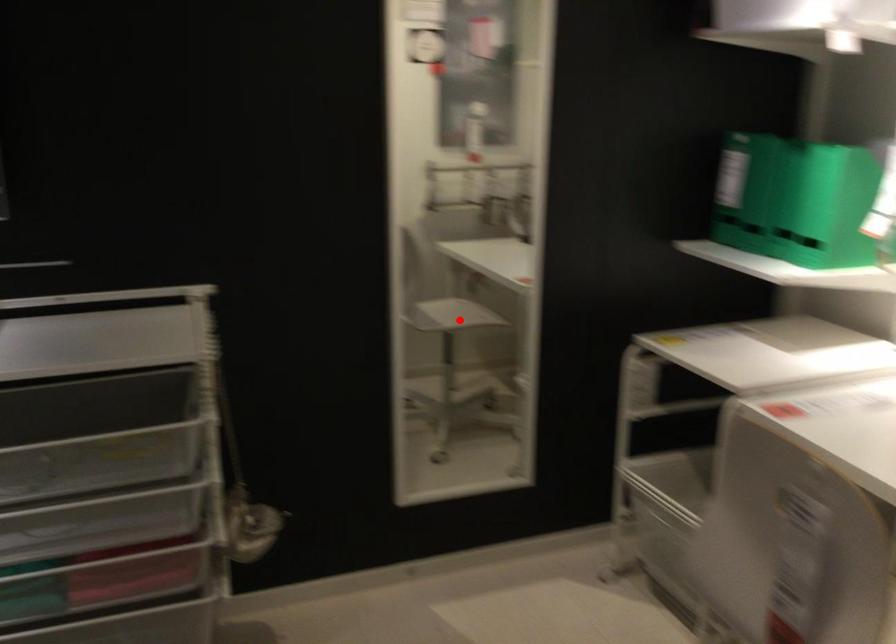
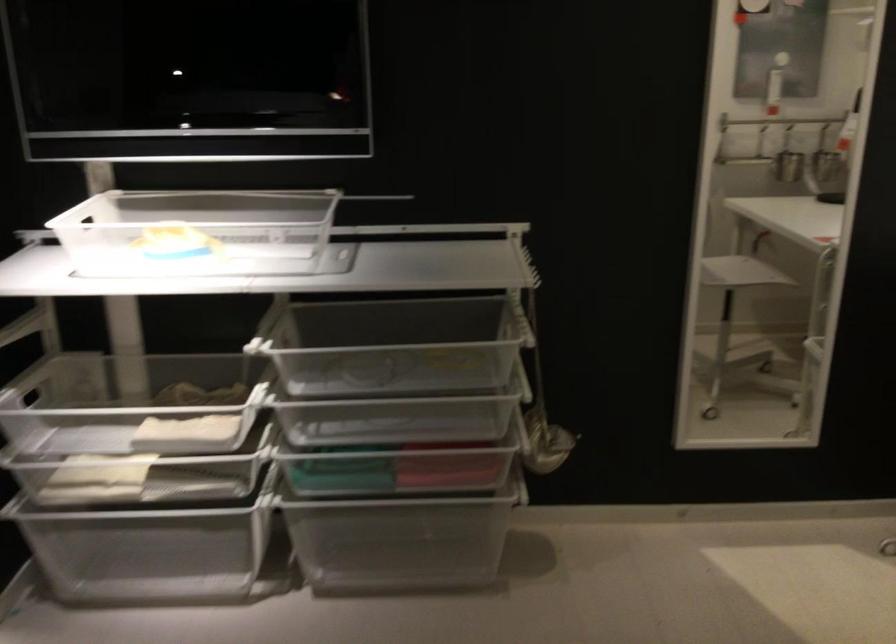
Where in the second image is the point corresponding to the highlighted location from the first image?

(739, 272)